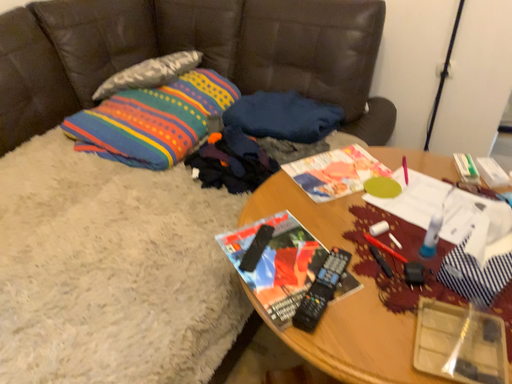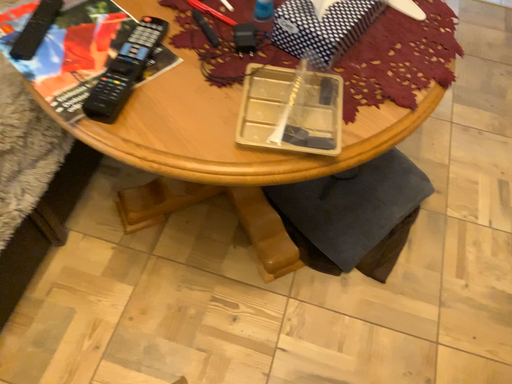
Question: Which way did the camera rotate in the video?

Choices:
 (A) rotated downward
 (B) rotated upward

Answer: (A)